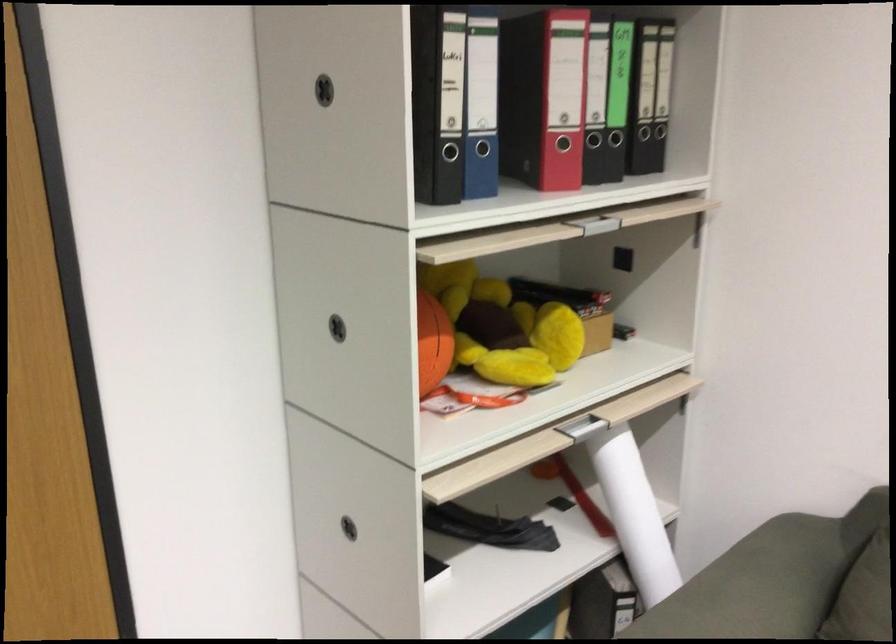
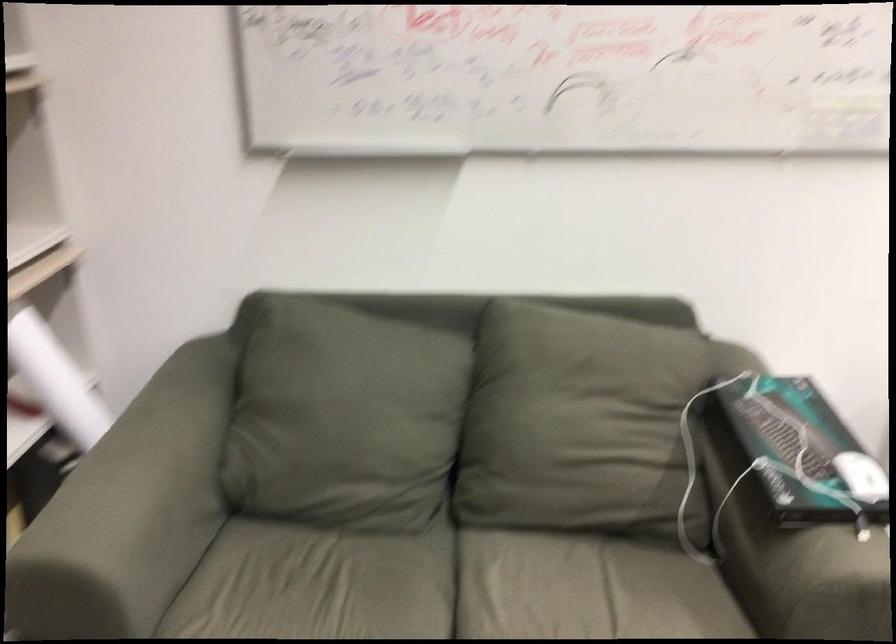
Question: How did the camera likely rotate?

Choices:
 (A) Left
 (B) Right
 (C) Up
 (D) Down

Answer: (B)